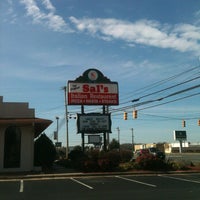
I want to click on window, so click(x=12, y=150).